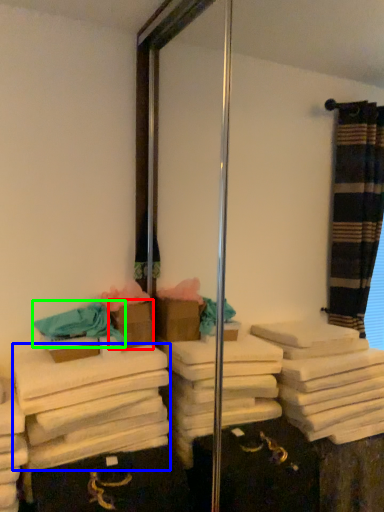
Question: Estimate the real-world distances between objects in this image. Which object is closer to box (highlighted by a red box), bath towel (highlighted by a blue box) or bath towel (highlighted by a green box)?

Choices:
 (A) bath towel
 (B) bath towel

Answer: (B)